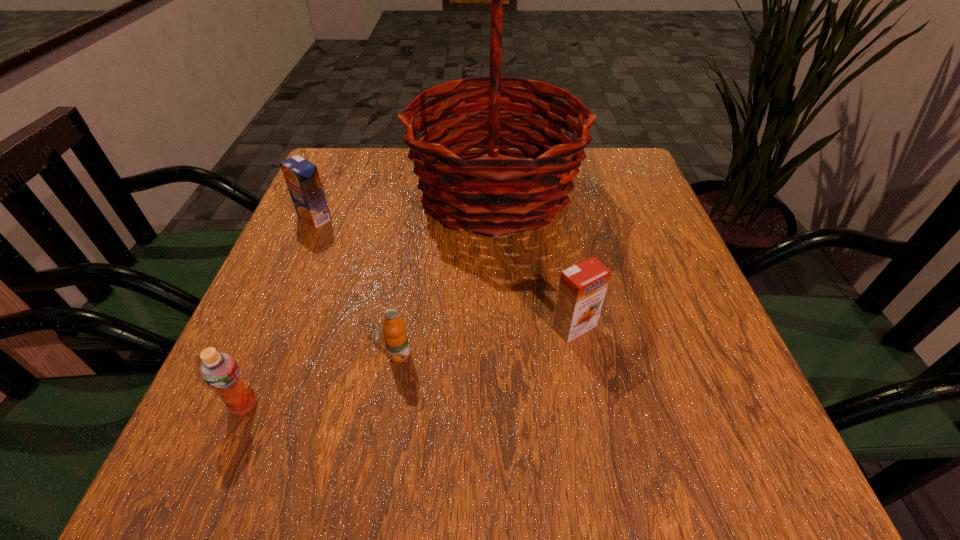
What are the coordinates of `object identified as the second closest to the shortest orange juice` in the screenshot? It's located at (582, 287).

Image resolution: width=960 pixels, height=540 pixels. Identify the location of the second closest orange juice to the farthest orange juice. (220, 371).

Select which orange juice is the third closest to the farthest orange juice. Please provide its 2D coordinates. Your answer should be formatted as a tuple, i.e. [(x, y)], where the tuple contains the x and y coordinates of a point satisfying the conditions above.

[(582, 287)]

The width and height of the screenshot is (960, 540). I want to click on free space that satisfies the following two spatial constraints: 1. on the front side of the second farthest orange juice; 2. on the left side of the farthest orange juice, so click(x=268, y=326).

The width and height of the screenshot is (960, 540). I want to click on free location that satisfies the following two spatial constraints: 1. on the front side of the nearest object; 2. on the right side of the farthest orange juice, so click(234, 404).